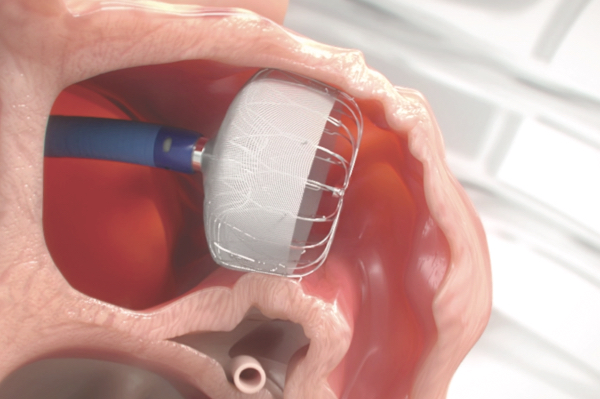
Identify the location of silver part of handle. This screenshot has height=399, width=600. click(198, 155).